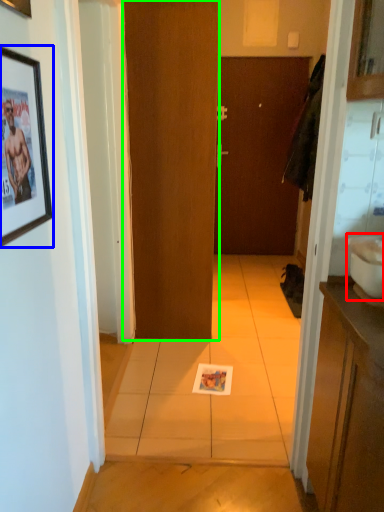
Question: Based on their relative distances, which object is farther from sink (highlighted by a red box)? Choose from picture frame (highlighted by a blue box) and door (highlighted by a green box).

Choices:
 (A) picture frame
 (B) door

Answer: (B)